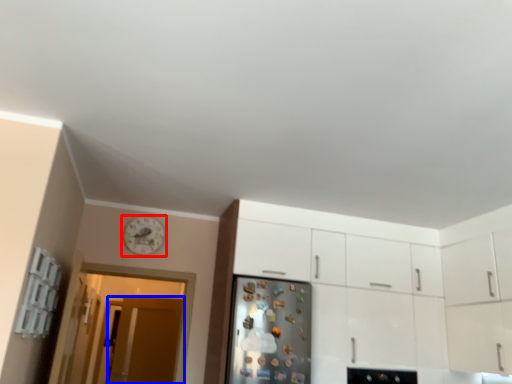
Question: Among these objects, which one is farthest to the camera, clock (highlighted by a red box) or door (highlighted by a blue box)?

Choices:
 (A) clock
 (B) door

Answer: (B)